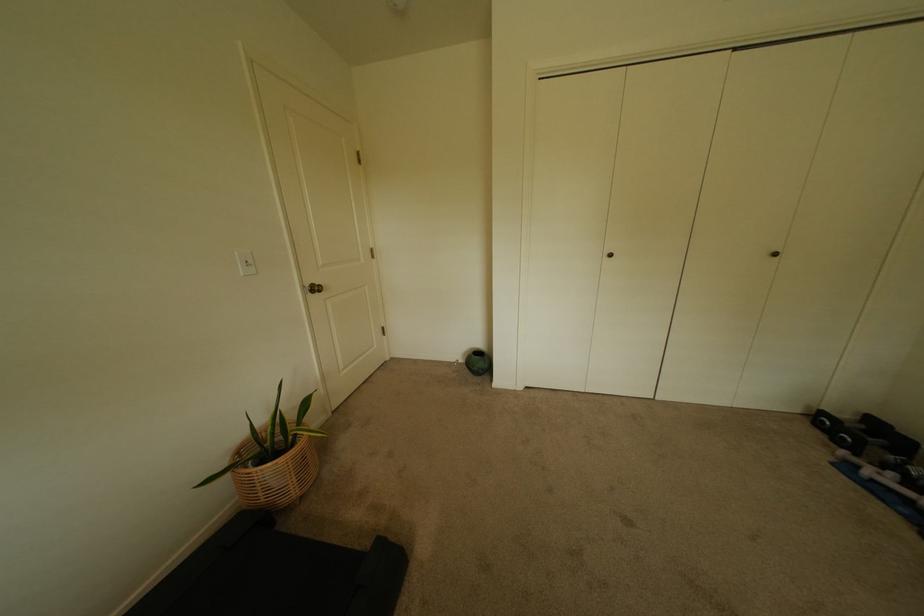
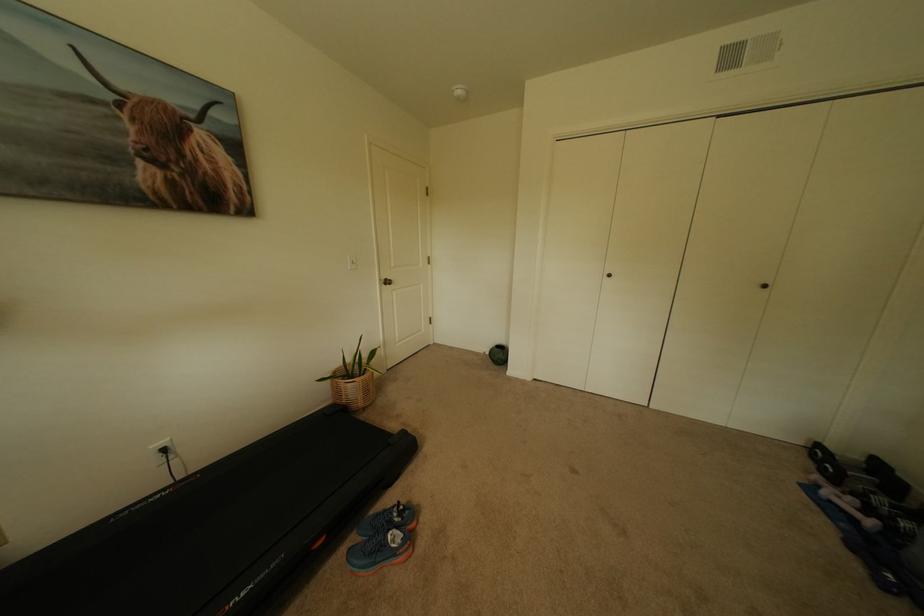
Where in the second image is the point corresponding to (832,419) from the first image?

(827, 452)